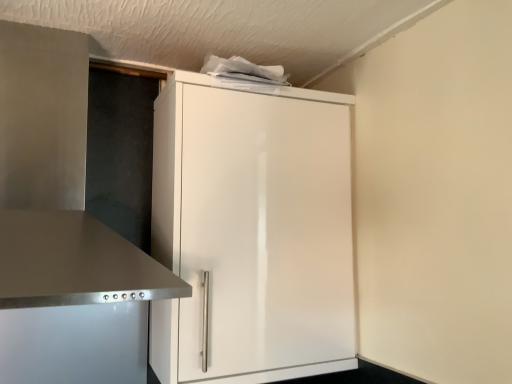
At what (x,y) coordinates should I click in order to perform the action: click on white glossy cupboard at center. Please return your answer as a coordinate pair (x, y). Image resolution: width=512 pixels, height=384 pixels. Looking at the image, I should click on (252, 231).

What do you see at coordinates (252, 231) in the screenshot? The width and height of the screenshot is (512, 384). I see `white glossy cupboard at center` at bounding box center [252, 231].

The width and height of the screenshot is (512, 384). Describe the element at coordinates (57, 185) in the screenshot. I see `stainless steel vent at left` at that location.

I want to click on stainless steel vent at left, so pyautogui.click(x=57, y=185).

Find the location of a particular element. This screenshot has width=512, height=384. white glossy cupboard at center is located at coordinates (x=252, y=231).

Which is more to the right, stainless steel vent at left or white glossy cupboard at center?

Positioned to the right is white glossy cupboard at center.

Is stainless steel vent at left in front of white glossy cupboard at center?

Yes.

Between point (76, 60) and point (192, 109), which one is positioned behind?

The point (76, 60) is farther.

From the image's perspective, does stainless steel vent at left appear higher than white glossy cupboard at center?

Yes, from the image's perspective, stainless steel vent at left is on top of white glossy cupboard at center.

From a real-world perspective, between stainless steel vent at left and white glossy cupboard at center, who is vertically higher?

In real-world perspective, stainless steel vent at left is above.

Considering the sizes of stainless steel vent at left and white glossy cupboard at center in the image, is stainless steel vent at left wider or thinner than white glossy cupboard at center?

Clearly, stainless steel vent at left has more width compared to white glossy cupboard at center.

Is stainless steel vent at left shorter than white glossy cupboard at center?

Indeed, stainless steel vent at left has a lesser height compared to white glossy cupboard at center.

Between stainless steel vent at left and white glossy cupboard at center, which one has smaller size?

With smaller size is stainless steel vent at left.

Looking at this image, would you say stainless steel vent at left is outside white glossy cupboard at center?

Yes, stainless steel vent at left is located beyond the bounds of white glossy cupboard at center.

Is stainless steel vent at left in contact with white glossy cupboard at center?

No.

Does stainless steel vent at left turn towards white glossy cupboard at center?

No.

I want to click on cupboard that appears below the stainless steel vent at left (from a real-world perspective), so click(252, 231).

Is white glossy cupboard at center to the right of stainless steel vent at left from the viewer's perspective?

Correct, you'll find white glossy cupboard at center to the right of stainless steel vent at left.

Based on the photo, is white glossy cupboard at center further to the viewer compared to stainless steel vent at left?

Yes, the depth of white glossy cupboard at center is greater than that of stainless steel vent at left.

Between point (264, 232) and point (37, 170), which one is positioned behind?

The point (264, 232) is behind.

From the image's perspective, who appears lower, white glossy cupboard at center or stainless steel vent at left?

white glossy cupboard at center, from the image's perspective.

From a real-world perspective, is white glossy cupboard at center above or below stainless steel vent at left?

white glossy cupboard at center is below stainless steel vent at left.

Based on the photo, looking at their sizes, would you say white glossy cupboard at center is wider or thinner than stainless steel vent at left?

In the image, white glossy cupboard at center appears to be more narrow than stainless steel vent at left.

Is white glossy cupboard at center taller than stainless steel vent at left?

Yes.

Who is bigger, white glossy cupboard at center or stainless steel vent at left?

With larger size is white glossy cupboard at center.

Is white glossy cupboard at center positioned beyond the bounds of stainless steel vent at left?

white glossy cupboard at center lies outside stainless steel vent at left's area.

Can you see white glossy cupboard at center touching stainless steel vent at left?

No, white glossy cupboard at center is not next to stainless steel vent at left.

Is white glossy cupboard at center aimed at stainless steel vent at left?

A: No, white glossy cupboard at center is not aimed at stainless steel vent at left.

Can you tell me how much white glossy cupboard at center and stainless steel vent at left differ in facing direction?

The angular difference between white glossy cupboard at center and stainless steel vent at left is 0.000432 degrees.

Find the location of a particular element. The height and width of the screenshot is (384, 512). vent on the left of white glossy cupboard at center is located at coordinates (57, 185).

The image size is (512, 384). I want to click on vent in front of the white glossy cupboard at center, so click(57, 185).

Identify the location of vent on the left of the white glossy cupboard at center. The image size is (512, 384). (57, 185).